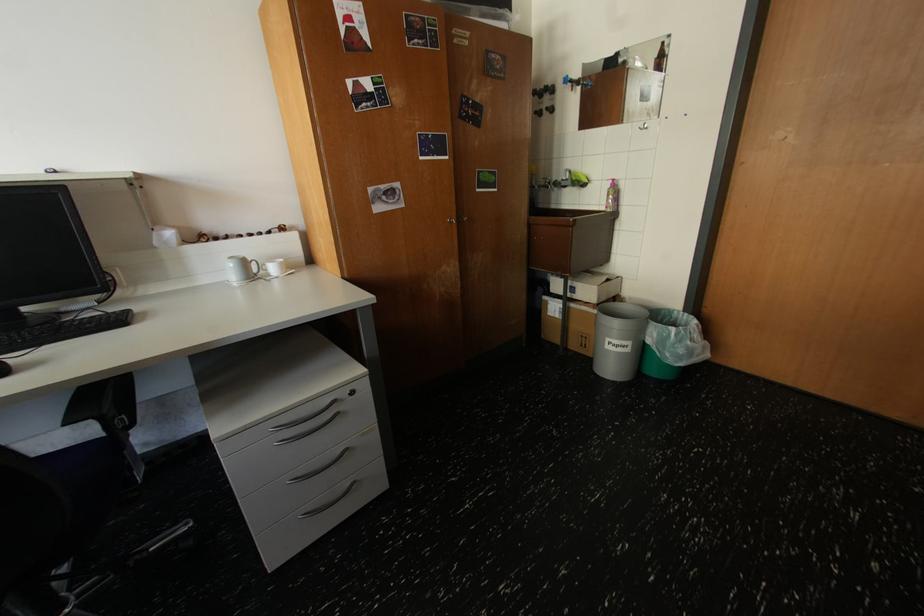
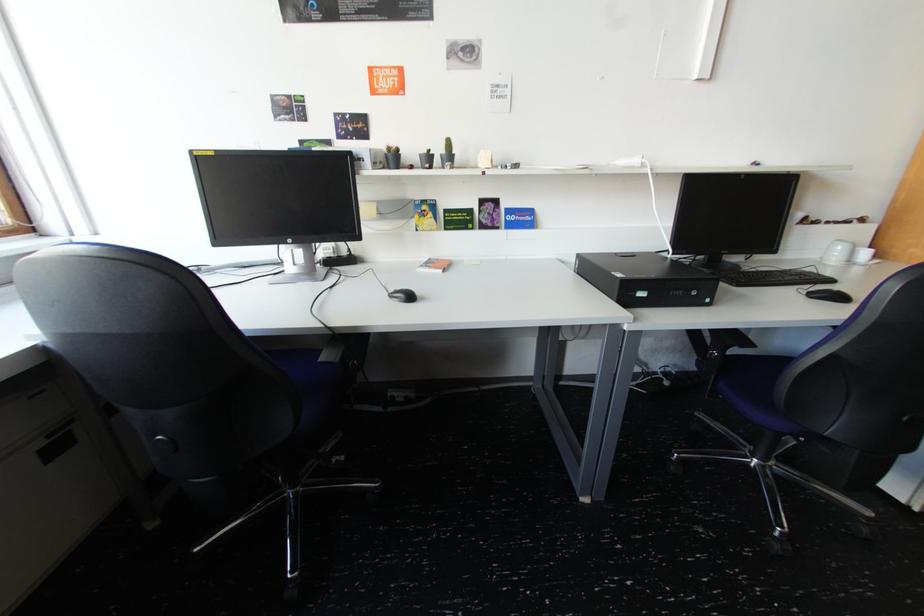
Locate, in the second image, the point that corresponds to point (239, 265) in the first image.

(849, 249)